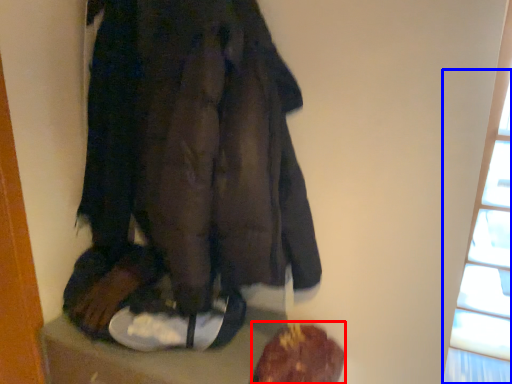
Question: Which of the following is the closest to the observer, food (highlighted by a red box) or window (highlighted by a blue box)?

Choices:
 (A) food
 (B) window

Answer: (B)